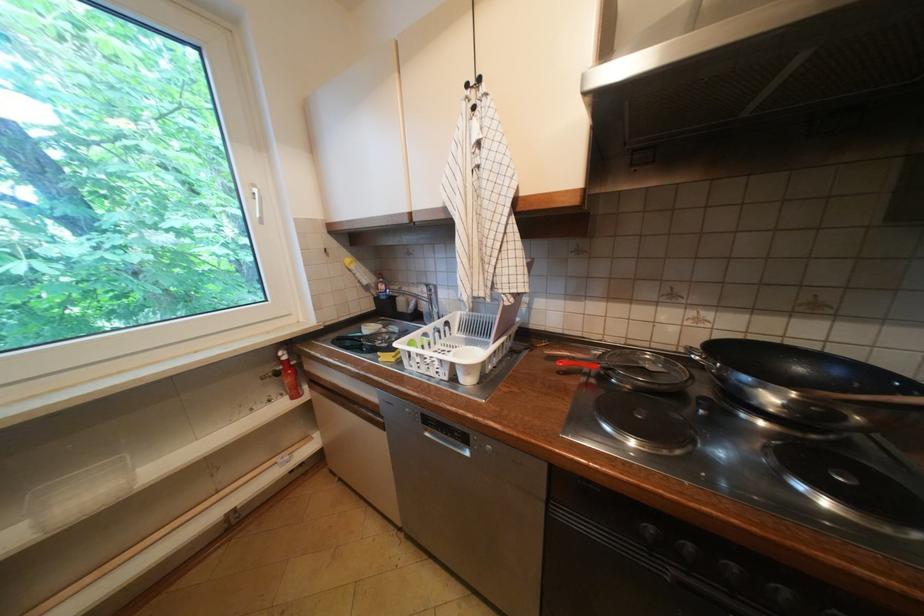
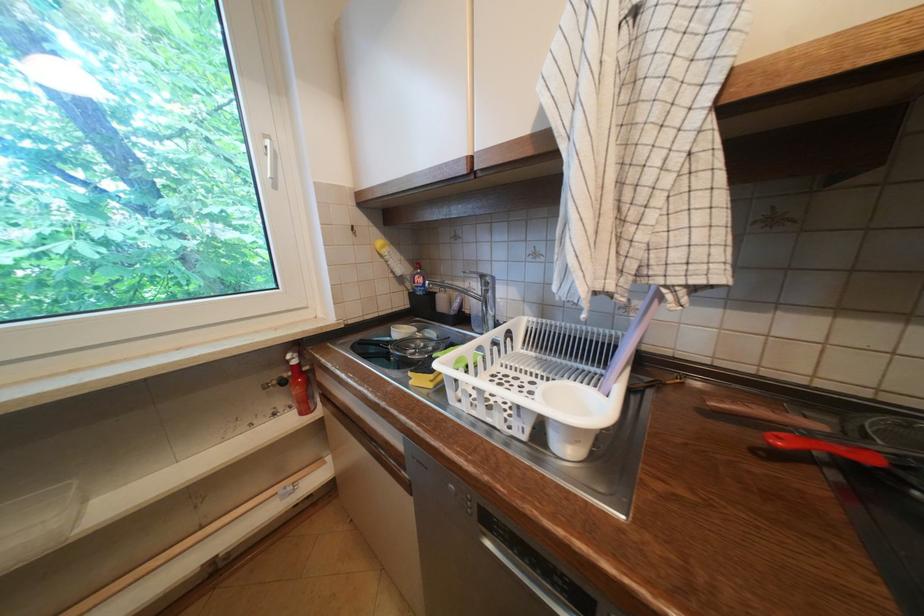
In the second image, find the point that corresponds to (x=379, y=296) in the first image.

(412, 291)